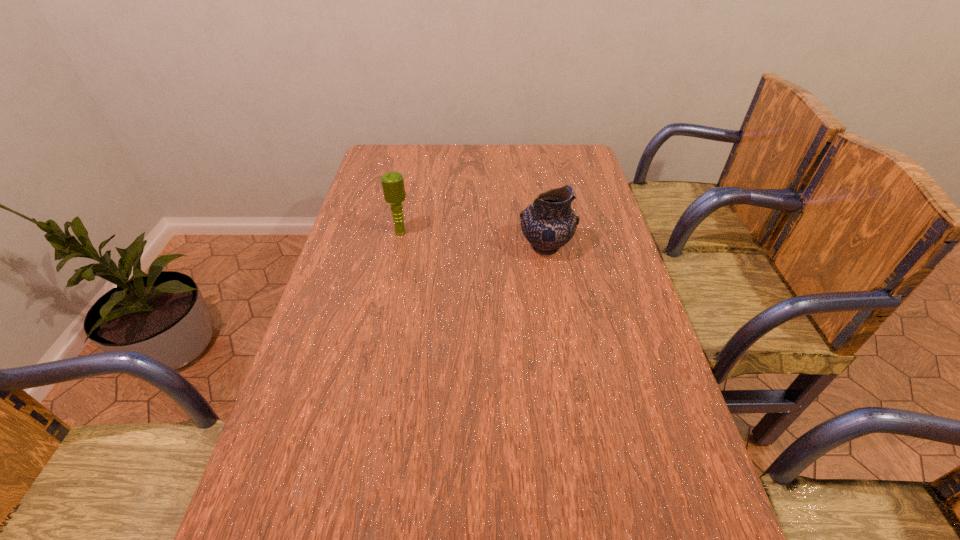
Where is `microphone`? microphone is located at coordinates (393, 187).

I want to click on the right object, so click(548, 223).

This screenshot has height=540, width=960. Identify the location of vacant space situated 0.070m on the left of the microphone. (368, 233).

The image size is (960, 540). What are the coordinates of `vacant space situated on the front of the right object` in the screenshot? It's located at (559, 327).

You are a GUI agent. You are given a task and a screenshot of the screen. Output one action in this format:
    pyautogui.click(x=<x>, y=<y>)
    Task: Click on the object located at the left edge
    Image resolution: width=960 pixels, height=540 pixels.
    Given the screenshot: What is the action you would take?
    pyautogui.click(x=393, y=187)

This screenshot has height=540, width=960. Identify the location of object positioned at the right edge. (548, 223).

Locate an element on the screen. vacant space at the far edge is located at coordinates (432, 156).

Find the location of a particular element. The image size is (960, 540). vacant area at the left edge of the desktop is located at coordinates (356, 218).

This screenshot has height=540, width=960. In order to click on vacant space at the right edge in this screenshot , I will do `click(608, 268)`.

This screenshot has width=960, height=540. Identify the location of blank space at the far left corner of the desktop. (391, 166).